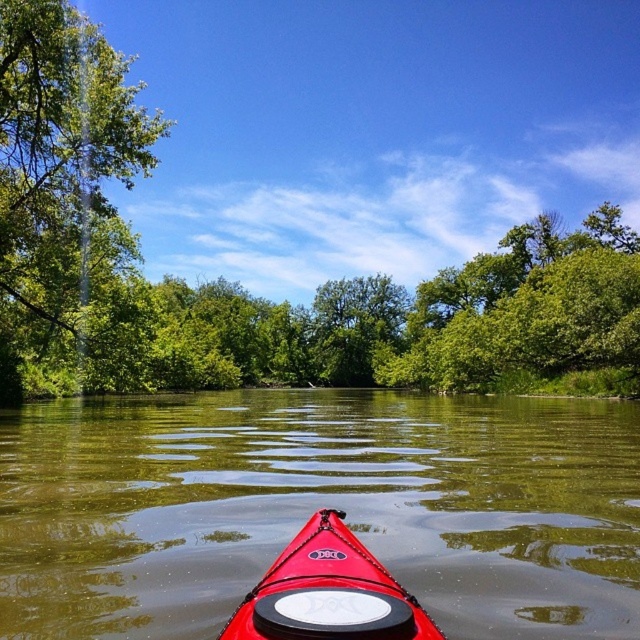
You are kayaking down a river and see a green leafy tree at left and a shiny red kayak at center. Which object is bigger in the image?

The green leafy tree at left is larger in size compared to the shiny red kayak at center according to the description.

You are kayaking down a river and see a green leafy tree at left and a shiny red kayak at center. Which object is higher in your field of view?

The green leafy tree at left is higher in your field of view because it is positioned above the shiny red kayak at center.